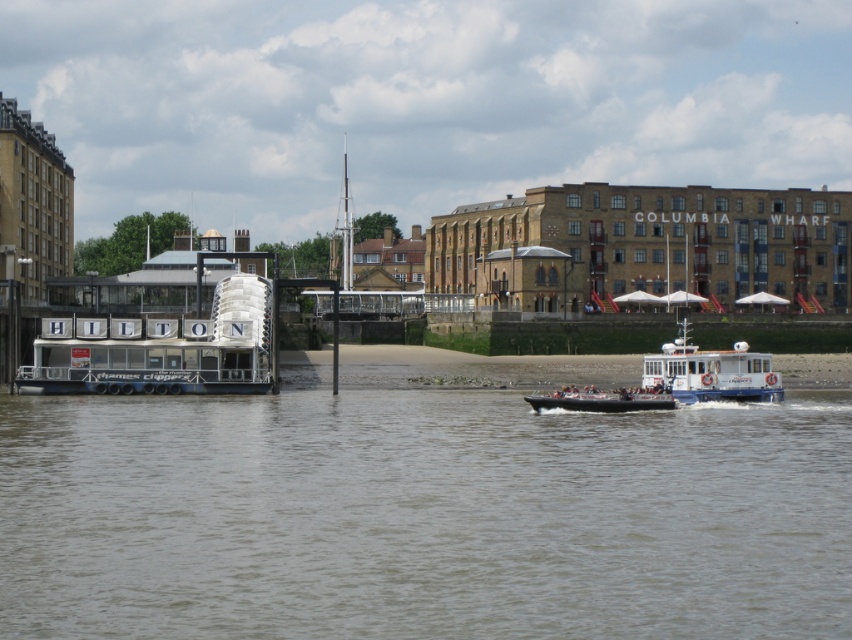
Is brown water at center bigger than white plastic boat at center-right?

Actually, brown water at center might be smaller than white plastic boat at center-right.

Who is positioned more to the right, brown water at center or white plastic boat at center-right?

From the viewer's perspective, white plastic boat at center-right appears more on the right side.

Is point (429, 390) farther from viewer compared to point (735, 348)?

Yes, it is behind point (735, 348).

Where is `brown water at center`? The width and height of the screenshot is (852, 640). brown water at center is located at coordinates (422, 516).

Is white matte boat at left taller than white plastic boat at center-right?

Correct, white matte boat at left is much taller as white plastic boat at center-right.

What do you see at coordinates (160, 349) in the screenshot? Image resolution: width=852 pixels, height=640 pixels. I see `white matte boat at left` at bounding box center [160, 349].

Where is `white matte boat at left`? This screenshot has width=852, height=640. white matte boat at left is located at coordinates (160, 349).

Does brown water at center appear under white matte boat at left?

Indeed, brown water at center is positioned under white matte boat at left.

Is brown water at center taller than white matte boat at left?

In fact, brown water at center may be shorter than white matte boat at left.

Locate an element on the screen. Image resolution: width=852 pixels, height=640 pixels. brown water at center is located at coordinates (422, 516).